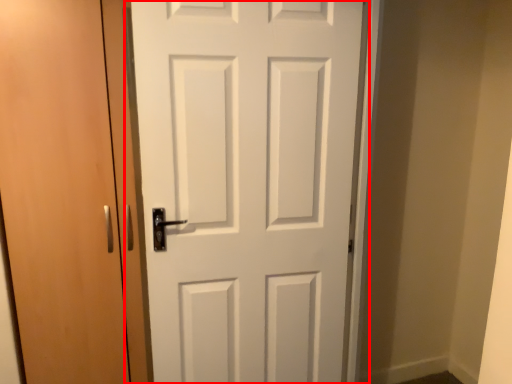
Question: Where is door (annotated by the red box) located in relation to door in the image?

Choices:
 (A) left
 (B) right

Answer: (B)